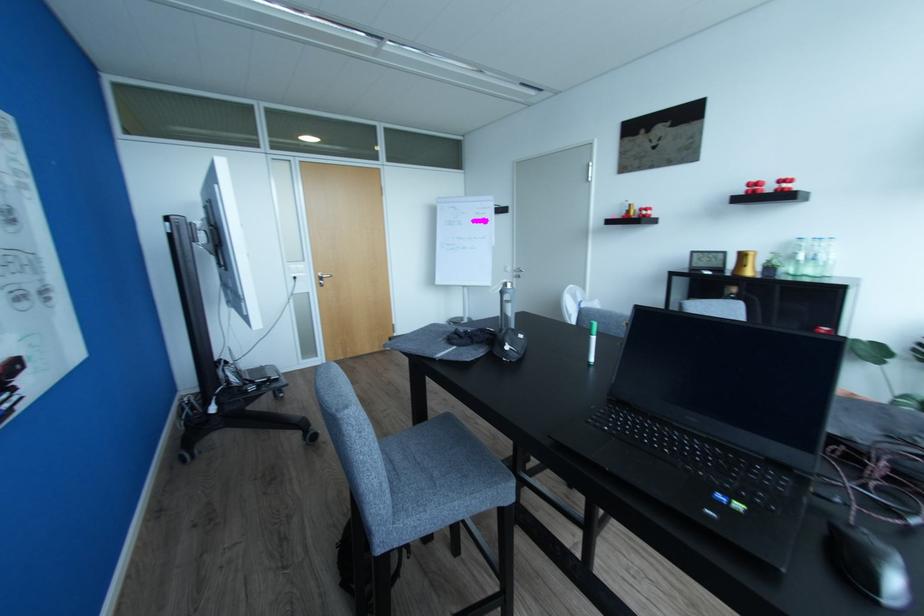
The location [812,257] corresponds to which object?

It refers to a glass water bottle.